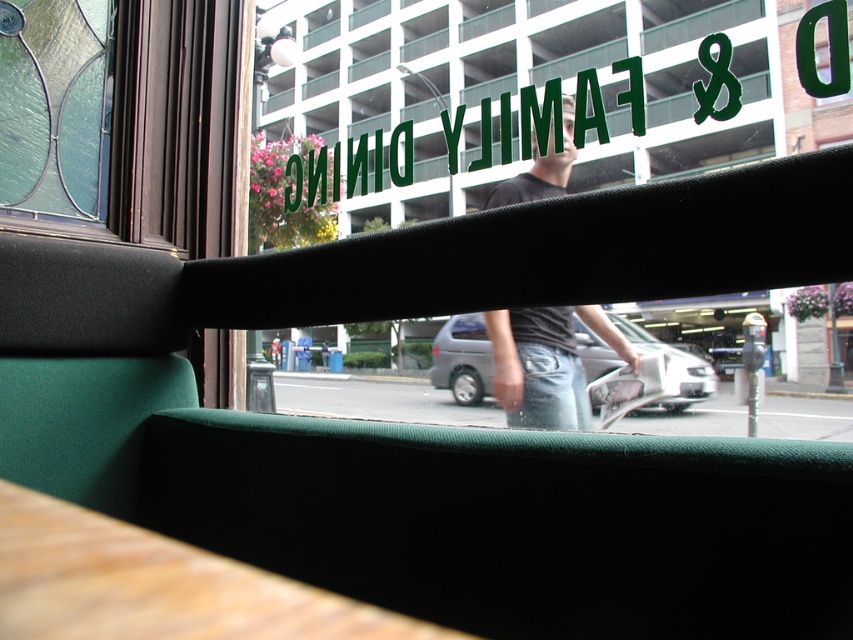
You are a painter who wants to paint the green fabric window at center and the wooden table at lower left. Which object has a greater width?

The green fabric window at center is wider than wooden table at lower left according to the description.

You are sitting at the wooden table at lower left and want to see the person wearing dark gray jeans at center outside. Can you see them clearly through the window?

The wooden table at lower left is in front of dark gray jeans at center, so the table might block your view of the dark gray jeans at center.